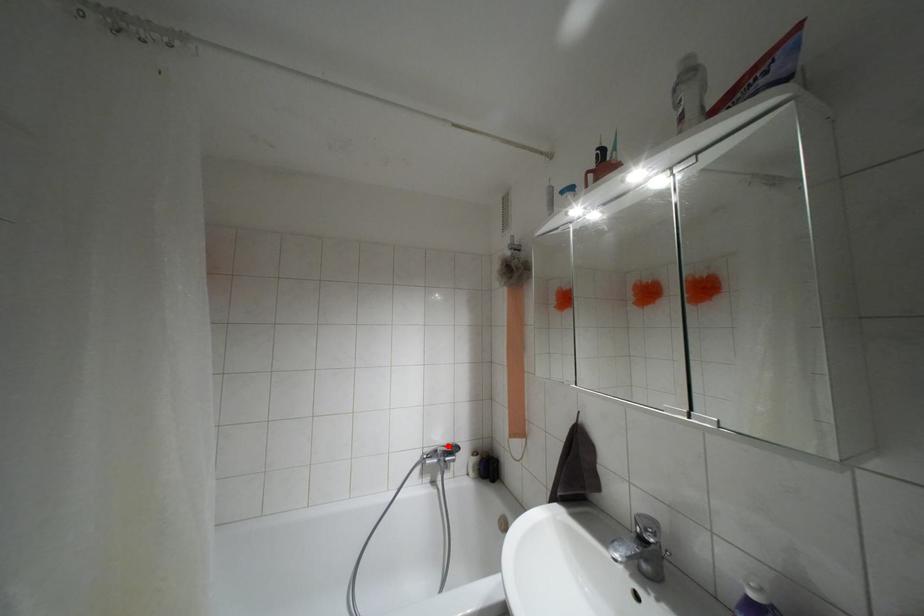
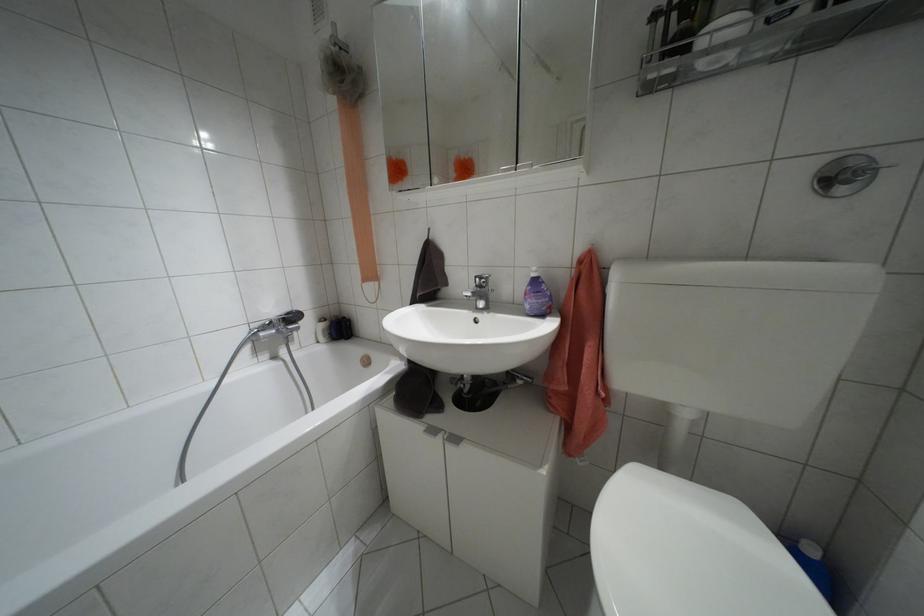
Question: I am providing you with two images of the same scene from different viewpoints. In image1, a red point is highlighted. Considering the same 3D point in image2, which of the following is correct?

Choices:
 (A) It is closer
 (B) It is farther

Answer: (A)